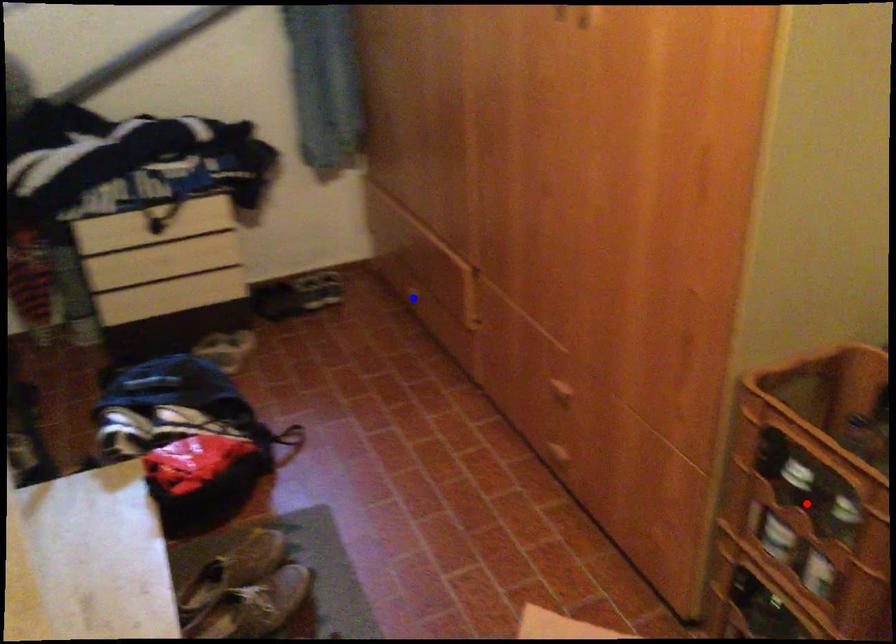
Question: Two points are marked on the image. Which point is closer to the camera?

Choices:
 (A) Blue point is closer.
 (B) Red point is closer.

Answer: (B)